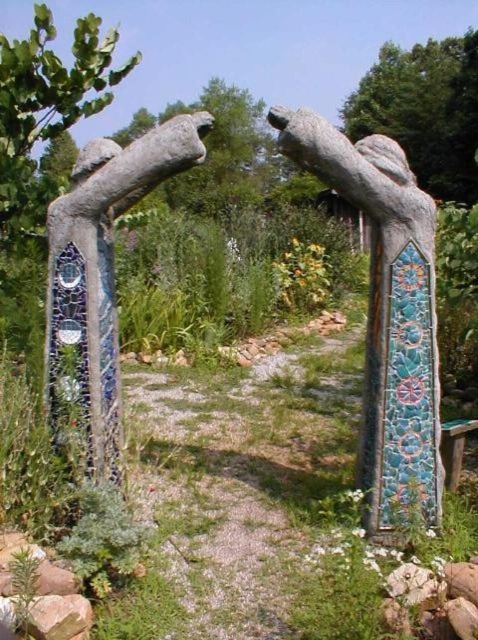
You are a gardener who wants to place a new flower pot between the mosaic stone statue at center and the mosaic tile arch at center. The flower pot is 24 inches wide. Will there be enough space to fit it between them?

The distance between the mosaic stone statue at center and the mosaic tile arch at center is 25.72 inches. Since the flower pot is 24 inches wide, there is enough space to fit it between them as 24 inches is less than 25.72 inches.

In the scene shown: You are standing at the entrance of the garden and want to walk towards the mosaic stone statue at center. Which direction should you turn from the mosaic tile arch at center to reach it?

The mosaic stone statue at center is to the right of the mosaic tile arch at center, so you should turn right from the mosaic tile arch at center to reach it.

You are standing at the entrance of the garden and see two points marked on the pathway. The first point is at coordinate point (422, 356) and the second is at coordinate point (85, 321). Which point is closer to you?

Point (422, 356) is closer to the viewer than point (85, 321).